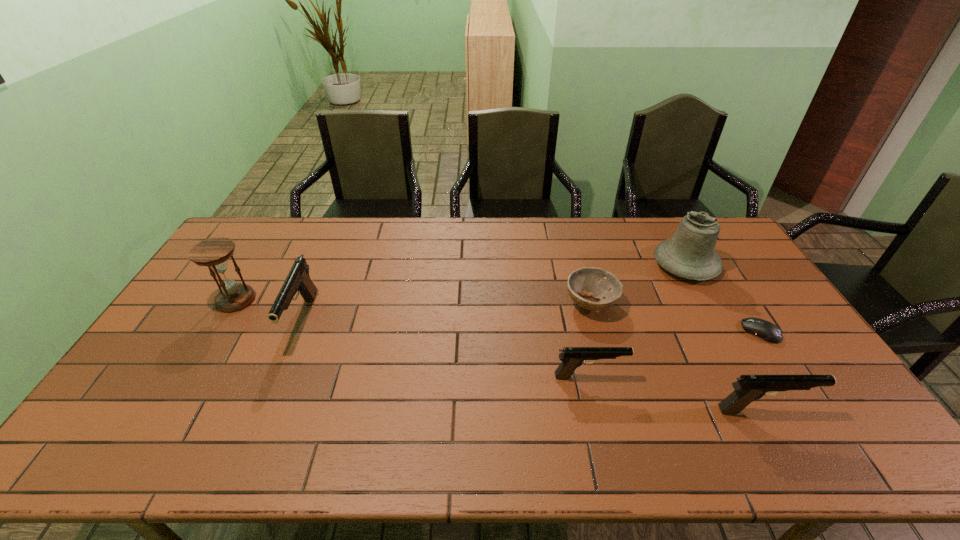
Find the location of a particular element. The image size is (960, 540). the leftmost pistol is located at coordinates (298, 281).

Where is `the farthest pistol`? the farthest pistol is located at coordinates (298, 281).

I want to click on the second pistol from right to left, so click(x=572, y=357).

Locate an element on the screen. the shortest pistol is located at coordinates (572, 357).

Find the location of a particular element. The image size is (960, 540). the fourth shortest object is located at coordinates (748, 388).

Identify the location of the rightmost pistol. This screenshot has width=960, height=540. (748, 388).

Locate an element on the screen. The height and width of the screenshot is (540, 960). bell is located at coordinates (690, 253).

Locate an element on the screen. This screenshot has height=540, width=960. hourglass is located at coordinates [x=214, y=253].

Identify the location of the sixth tallest object. The width and height of the screenshot is (960, 540). (598, 283).

Locate an element on the screen. The width and height of the screenshot is (960, 540). computer equipment is located at coordinates (766, 330).